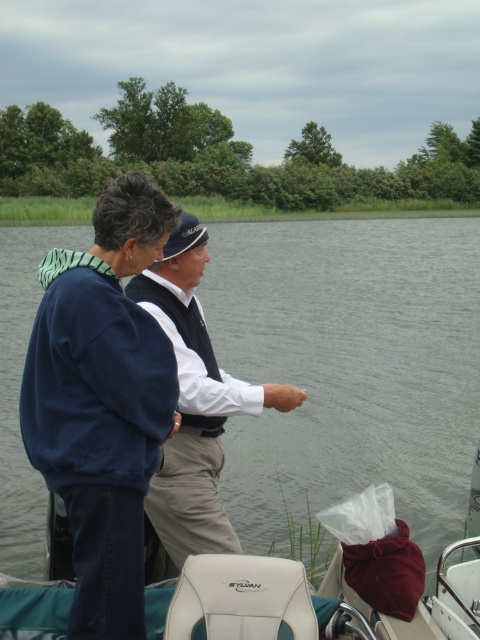
Question: Is navy blue sweatshirt at center to the left of white cotton shirt at center from the viewer's perspective?

Choices:
 (A) yes
 (B) no

Answer: (A)

Question: Which object appears closest to the camera in this image?

Choices:
 (A) navy blue sweatshirt at center
 (B) clear water at center
 (C) white cotton shirt at center

Answer: (C)

Question: Is clear water at center positioned at the back of white cotton shirt at center?

Choices:
 (A) no
 (B) yes

Answer: (B)

Question: Among these objects, which one is nearest to the camera?

Choices:
 (A) navy blue sweatshirt at center
 (B) white cotton shirt at center
 (C) clear water at center

Answer: (B)

Question: Is clear water at center thinner than navy blue sweatshirt at center?

Choices:
 (A) yes
 (B) no

Answer: (B)

Question: Which object is positioned closest to the navy blue sweatshirt at center?

Choices:
 (A) clear water at center
 (B) white cotton shirt at center

Answer: (B)